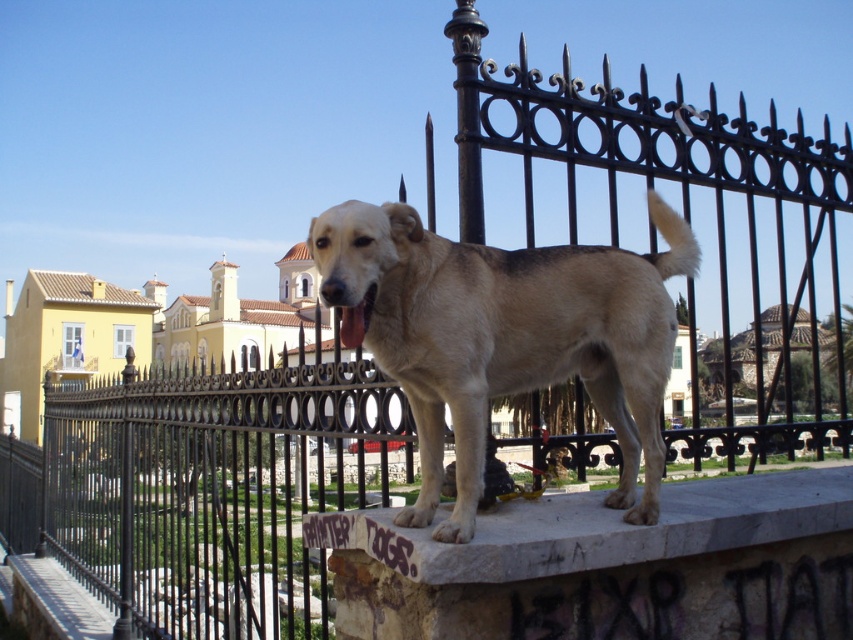
In the scene shown: Can you confirm if light brown fur at center is thinner than marble ledge at center?

Correct, light brown fur at center's width is less than marble ledge at center's.

Who is shorter, light brown fur at center or marble ledge at center?

marble ledge at center is shorter.

What do you see at coordinates (508, 337) in the screenshot?
I see `light brown fur at center` at bounding box center [508, 337].

I want to click on light brown fur at center, so click(508, 337).

Does marble ledge at center have a smaller size compared to pink glossy tongue at center?

No.

Where is `marble ledge at center`? This screenshot has height=640, width=853. marble ledge at center is located at coordinates [596, 529].

This screenshot has height=640, width=853. I want to click on marble ledge at center, so click(x=596, y=529).

Which of these two, light brown fur at center or pink glossy tongue at center, stands shorter?

With less height is pink glossy tongue at center.

I want to click on light brown fur at center, so click(x=508, y=337).

What do you see at coordinates (508, 337) in the screenshot?
I see `light brown fur at center` at bounding box center [508, 337].

Image resolution: width=853 pixels, height=640 pixels. What are the coordinates of `light brown fur at center` in the screenshot? It's located at (508, 337).